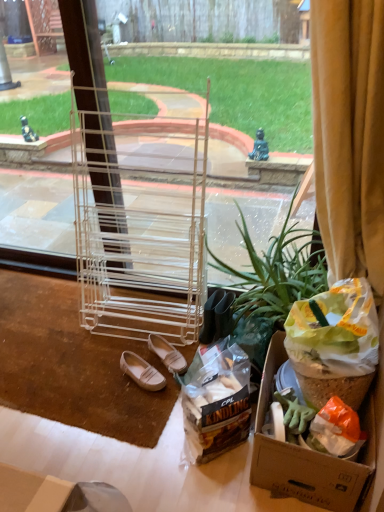
Question: Should I look upward or downward to see yellow velvet curtain at right?

Choices:
 (A) up
 (B) down

Answer: (A)

Question: Does leather at center, which ranks as the 1th footwear in right-to-left order, appear on the right side of green leafy plant at center?

Choices:
 (A) no
 (B) yes

Answer: (A)

Question: Is the position of leather at center, the 2th footwear when ordered from left to right, more distant than that of green leafy plant at center?

Choices:
 (A) yes
 (B) no

Answer: (A)

Question: Is the surface of leather at center, which ranks as the 1th footwear in right-to-left order, in direct contact with green leafy plant at center?

Choices:
 (A) no
 (B) yes

Answer: (A)

Question: Considering the relative sizes of leather at center, the 2th footwear when ordered from left to right, and green leafy plant at center in the image provided, is leather at center, the 2th footwear when ordered from left to right, thinner than green leafy plant at center?

Choices:
 (A) no
 (B) yes

Answer: (B)

Question: From the image's perspective, does leather at center, the 2th footwear when ordered from left to right, appear higher than green leafy plant at center?

Choices:
 (A) yes
 (B) no

Answer: (B)

Question: From a real-world perspective, is leather at center, which ranks as the 1th footwear in right-to-left order, physically below green leafy plant at center?

Choices:
 (A) no
 (B) yes

Answer: (B)

Question: Is translucent plastic bag of kindling at lower center inside yellow velvet curtain at right?

Choices:
 (A) yes
 (B) no

Answer: (B)

Question: Is yellow velvet curtain at right smaller than translucent plastic bag of kindling at lower center?

Choices:
 (A) no
 (B) yes

Answer: (A)

Question: From the image's perspective, is yellow velvet curtain at right beneath translucent plastic bag of kindling at lower center?

Choices:
 (A) yes
 (B) no

Answer: (B)

Question: Is yellow velvet curtain at right not close to translucent plastic bag of kindling at lower center?

Choices:
 (A) no
 (B) yes

Answer: (A)

Question: Is yellow velvet curtain at right to the right of translucent plastic bag of kindling at lower center from the viewer's perspective?

Choices:
 (A) yes
 (B) no

Answer: (A)

Question: From a real-world perspective, is yellow velvet curtain at right on top of translucent plastic bag of kindling at lower center?

Choices:
 (A) yes
 (B) no

Answer: (A)

Question: From a real-world perspective, is green leafy plant at center below white leather shoes at lower center, which is counted as the 2th footwear, starting from the right?

Choices:
 (A) yes
 (B) no

Answer: (B)